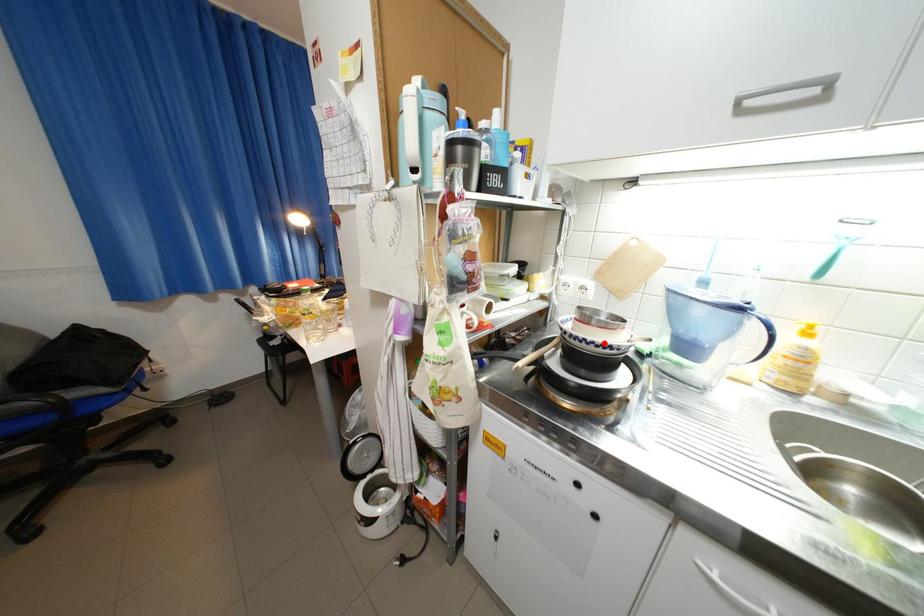
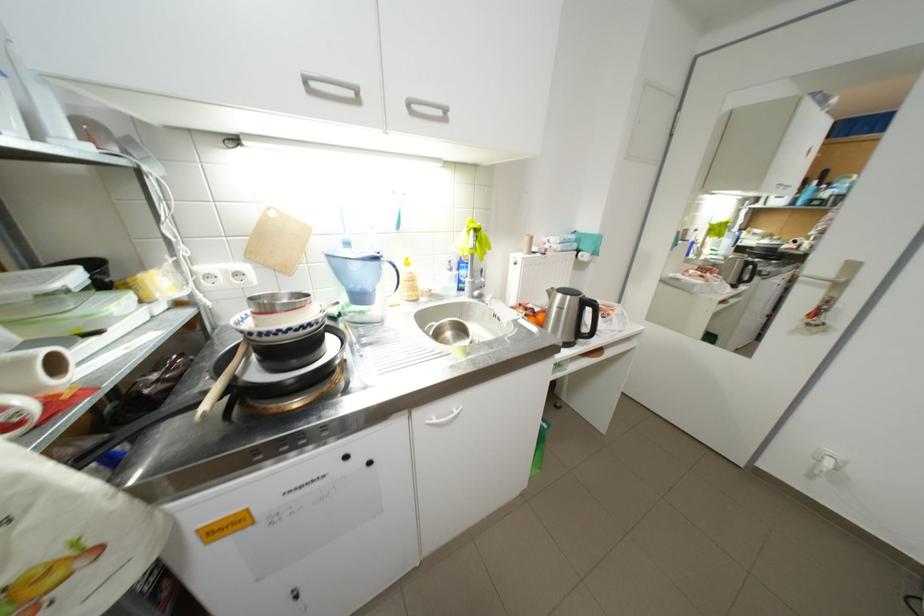
The point at the highlighted location is marked in the first image. Where is the corresponding point in the second image?

(300, 330)